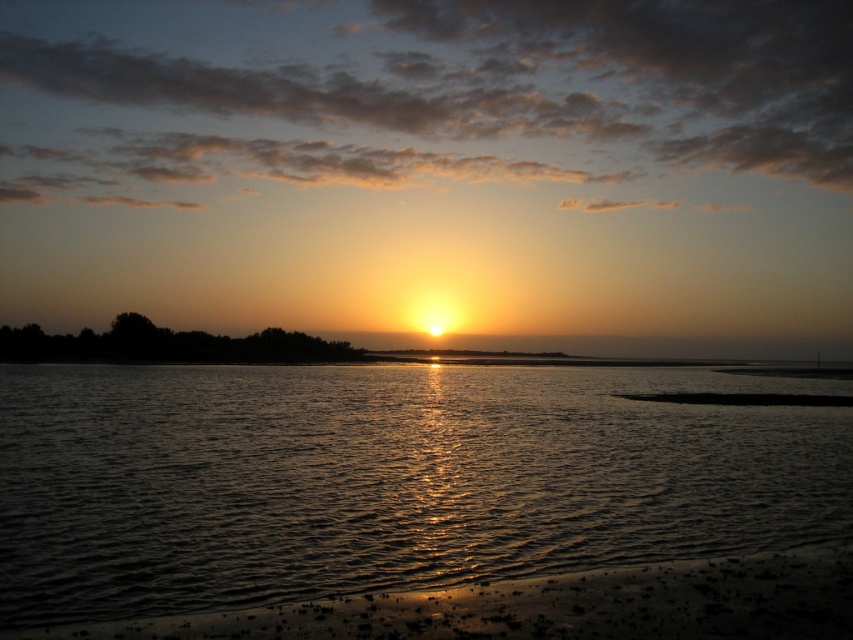
Does point (190, 572) come farther from viewer compared to point (183, 620)?

Yes, point (190, 572) is farther from viewer.

Is point (469, 506) in front of point (488, 630)?

No, (469, 506) is further to viewer.

Is point (519, 413) behind point (642, 611)?

Yes, it is behind point (642, 611).

Where is `glistening water at center`? This screenshot has height=640, width=853. glistening water at center is located at coordinates (383, 477).